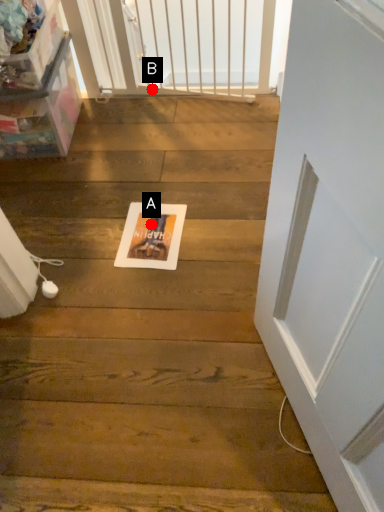
Question: Two points are circled on the image, labeled by A and B beside each circle. Which point is closer to the camera?

Choices:
 (A) A is closer
 (B) B is closer

Answer: (A)